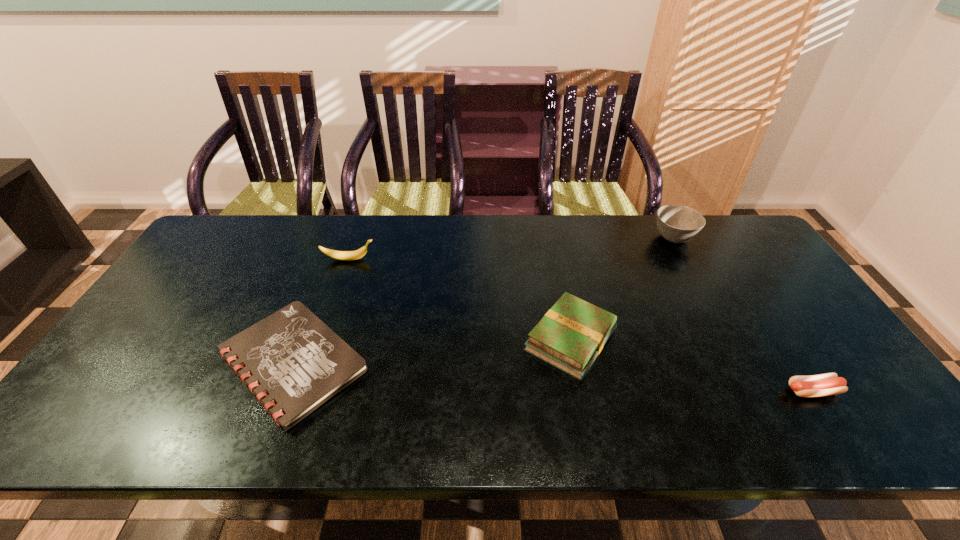
Where is `the farthest object`? This screenshot has width=960, height=540. the farthest object is located at coordinates (676, 223).

Locate an element on the screen. the fourth nearest object is located at coordinates (357, 254).

Identify the location of the third object from right to left. This screenshot has height=540, width=960. (570, 336).

Image resolution: width=960 pixels, height=540 pixels. Find the location of `the third tallest object`. the third tallest object is located at coordinates (570, 336).

Identify the location of sausage. (827, 384).

The height and width of the screenshot is (540, 960). I want to click on notebook, so click(x=293, y=362).

I want to click on free space located 0.090m on the right of the farthest object, so click(x=723, y=238).

This screenshot has height=540, width=960. What are the coordinates of `vacant point located at the stem of the fourth nearest object` in the screenshot? It's located at (493, 259).

Locate an element on the screen. The image size is (960, 540). vacant space located 0.090m on the right of the third object from right to left is located at coordinates (654, 340).

You are a GUI agent. You are given a task and a screenshot of the screen. Output one action in this format:
    pyautogui.click(x=<x>, y=<y>)
    Task: Click on the vacant space situated on the left of the sausage
    This screenshot has width=960, height=540.
    Given the screenshot: What is the action you would take?
    pyautogui.click(x=674, y=391)